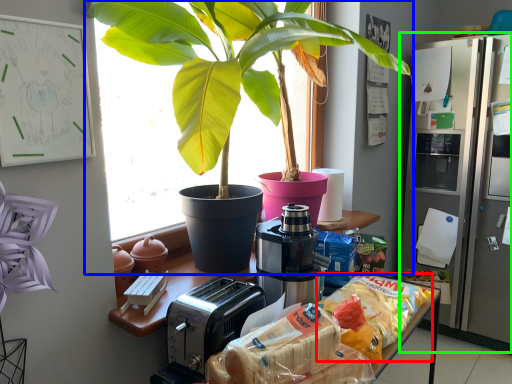
Question: Which object is the closest to the snack (highlighted by a red box)? Choose among these: houseplant (highlighted by a blue box) or fridge (highlighted by a green box).

Choices:
 (A) houseplant
 (B) fridge

Answer: (A)